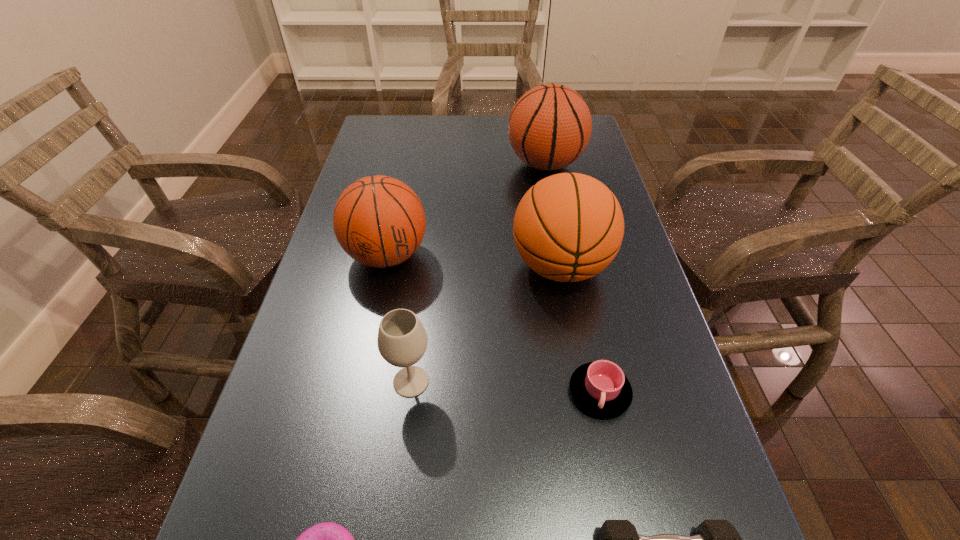
At what (x,y) coordinates should I click in order to perform the action: click on object that is at the far edge. Please return your answer as a coordinate pair (x, y). Looking at the image, I should click on (549, 127).

The width and height of the screenshot is (960, 540). I want to click on object situated at the left edge, so click(x=379, y=221).

Where is `cup that is at the right edge`? The image size is (960, 540). cup that is at the right edge is located at coordinates (601, 388).

Where is `object that is at the far right corner`? object that is at the far right corner is located at coordinates (549, 127).

The width and height of the screenshot is (960, 540). Identify the location of vacant area at the far edge of the desktop. (420, 144).

The width and height of the screenshot is (960, 540). In order to click on vacant space at the left edge of the desktop in this screenshot , I will do `click(279, 387)`.

In the image, there is a desktop. In order to click on free space at the right edge in this screenshot , I will do `click(630, 437)`.

The width and height of the screenshot is (960, 540). In order to click on vacant space at the far left corner of the desktop in this screenshot , I will do `click(392, 115)`.

In order to click on object identified as the fifth closest to the doughnut in this screenshot , I will do `click(568, 227)`.

Locate which object ranks second in proximity to the dumbbell. Please provide its 2D coordinates. Your answer should be formatted as a tuple, i.e. [(x, y)], where the tuple contains the x and y coordinates of a point satisfying the conditions above.

[(402, 340)]